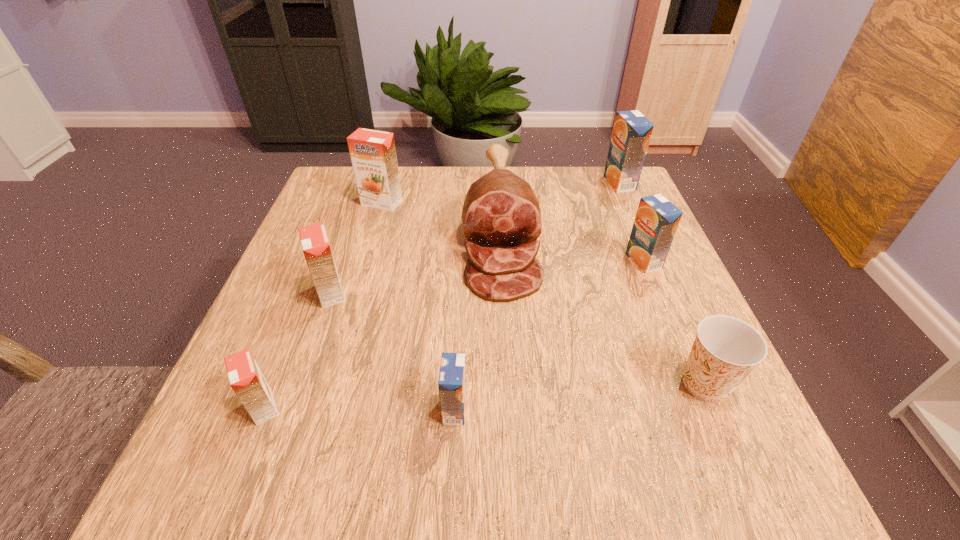
In the image, there is a desktop. At what (x,y) coordinates should I click in order to perform the action: click on vacant region at the near right corner. Please return your answer as a coordinate pair (x, y). Image resolution: width=960 pixels, height=540 pixels. Looking at the image, I should click on (709, 470).

In order to click on free space between the farthest orange orange juice and the third orange_juice from right to left in this screenshot , I will do `click(419, 306)`.

You are a GUI agent. You are given a task and a screenshot of the screen. Output one action in this format:
    pyautogui.click(x=<x>, y=<y>)
    Task: Click on the vacant point located between the farthest orange orange juice and the ham
    
    Given the screenshot: What is the action you would take?
    pyautogui.click(x=441, y=217)

You are a GUI agent. You are given a task and a screenshot of the screen. Output one action in this format:
    pyautogui.click(x=<x>, y=<y>)
    Task: Click on the free space between the third nearest orange_juice and the nearest orange orange juice
    This screenshot has height=540, width=960.
    Given the screenshot: What is the action you would take?
    298,350

The width and height of the screenshot is (960, 540). In order to click on free space that is in between the orange Dixie cup and the second nearest orange orange juice in this screenshot , I will do `click(518, 338)`.

In order to click on free area in between the ham and the farthest blue orange_juice in this screenshot , I will do `click(560, 207)`.

Image resolution: width=960 pixels, height=540 pixels. I want to click on empty space between the second farthest blue orange_juice and the biggest blue orange_juice, so click(632, 222).

You are a GUI agent. You are given a task and a screenshot of the screen. Output one action in this format:
    pyautogui.click(x=<x>, y=<y>)
    Task: Click on the blank region between the ham and the nearest orange orange juice
    
    Given the screenshot: What is the action you would take?
    pyautogui.click(x=382, y=319)

Identify the location of free space between the fourth farthest orange_juice and the nearest blue orange_juice. The width and height of the screenshot is (960, 540). (393, 351).

Locate an element on the screen. This screenshot has height=540, width=960. object identified as the closest to the smallest orange orange juice is located at coordinates (315, 244).